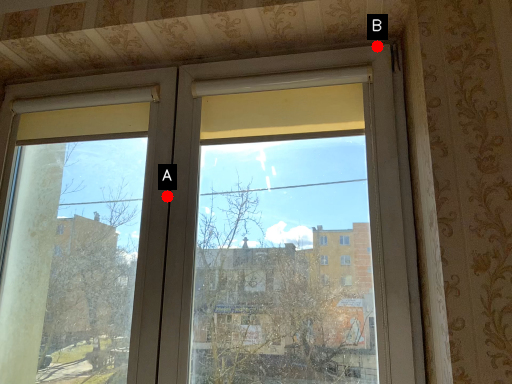
Question: Two points are circled on the image, labeled by A and B beside each circle. Which of the following is the farthest from the observer?

Choices:
 (A) A is further
 (B) B is further

Answer: (A)